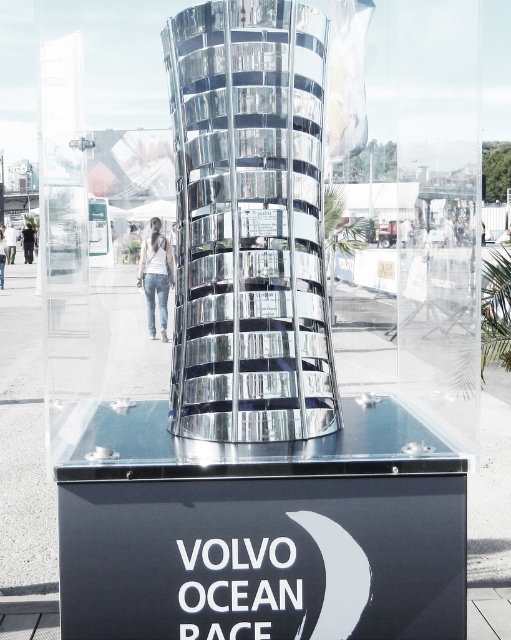
You are a photographer setting up a shoot in a museum. You have a polished metallic trophy at center and denim jeans at center in front of you. You need to capture an image where both objects are clearly visible but the trophy should dominate the frame. Which object should you focus on first to ensure proper exposure and depth of field?

The polished metallic trophy at center is larger than the denim jeans at center, so focusing on the trophy first will ensure it dominates the frame and allows proper exposure and depth of field adjustments.

From the picture: You are a photographer standing 5 feet away from the shiny metallic tower at center. You want to take a closeup shot of it. Can you move closer to get a better shot without exceeding the 5 feet distance limit?

The shiny metallic tower at center and camera are 4.89 feet apart from each other. Since you are already standing 5 feet away, you can move slightly closer to get a better shot as 4.89 feet is within the 5 feet limit.